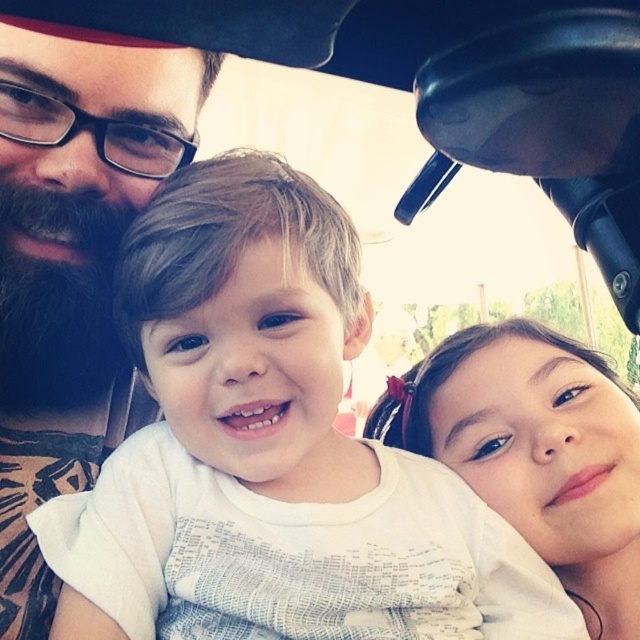
Is bearded man at left wider than smooth skin face at right?

No.

Between point (70, 348) and point (625, 625), which one is positioned in front?

Point (70, 348) is in front.

This screenshot has height=640, width=640. Describe the element at coordinates (72, 260) in the screenshot. I see `bearded man at left` at that location.

In order to click on bearded man at left in this screenshot , I will do `click(72, 260)`.

Can you confirm if white cotton shirt at center is bigger than smooth skin face at right?

No, white cotton shirt at center is not bigger than smooth skin face at right.

Is white cotton shirt at center below smooth skin face at right?

Yes.

Where is `white cotton shirt at center`? Image resolution: width=640 pixels, height=640 pixels. white cotton shirt at center is located at coordinates (272, 451).

Does white cotton shirt at center have a lesser width compared to bearded man at left?

In fact, white cotton shirt at center might be wider than bearded man at left.

Can you confirm if white cotton shirt at center is positioned below bearded man at left?

Indeed, white cotton shirt at center is positioned under bearded man at left.

Identify the location of white cotton shirt at center. This screenshot has height=640, width=640. (272, 451).

Where is `white cotton shirt at center`? This screenshot has width=640, height=640. white cotton shirt at center is located at coordinates click(x=272, y=451).